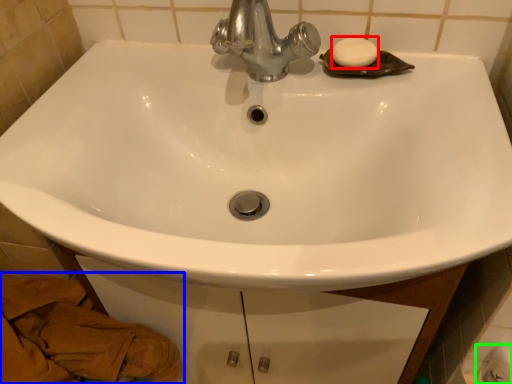
Question: Considering the real-world distances, which object is closest to soap (highlighted by a red box)? material (highlighted by a blue box) or toilet paper (highlighted by a green box).

Choices:
 (A) material
 (B) toilet paper

Answer: (B)